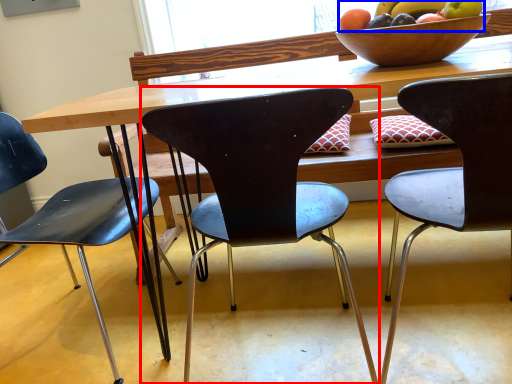
Question: Among these objects, which one is farthest to the camera, chair (highlighted by a red box) or grapefruit (highlighted by a blue box)?

Choices:
 (A) chair
 (B) grapefruit

Answer: (B)